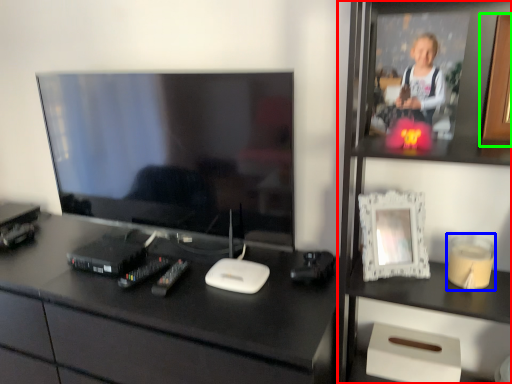
Question: Which object is positioned farthest from bookshelf (highlighted by a red box)? Select from candle holder (highlighted by a blue box) and picture frame (highlighted by a green box).

Choices:
 (A) candle holder
 (B) picture frame

Answer: (B)